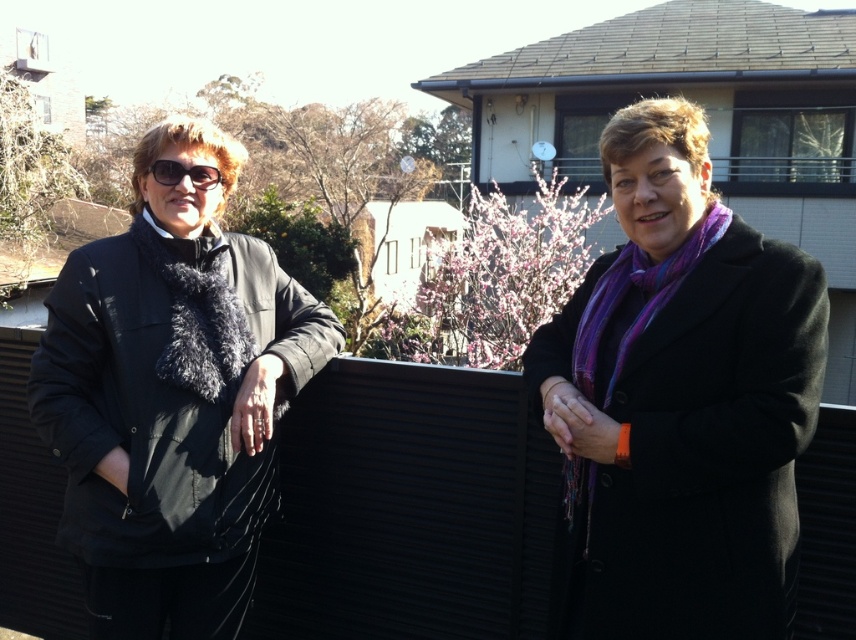
Question: Among these objects, which one is farthest from the camera?

Choices:
 (A) purple wool scarf at center
 (B) black fuzzy scarf at left
 (C) black matte sunglasses at left

Answer: (C)

Question: Does black fuzzy scarf at left appear under black matte sunglasses at left?

Choices:
 (A) no
 (B) yes

Answer: (B)

Question: Does purple wool scarf at center have a larger size compared to black fuzzy scarf at left?

Choices:
 (A) no
 (B) yes

Answer: (A)

Question: Among these objects, which one is farthest from the camera?

Choices:
 (A) black matte sunglasses at left
 (B) purple wool scarf at center

Answer: (A)

Question: Can you confirm if purple wool scarf at center is positioned to the right of black matte sunglasses at left?

Choices:
 (A) no
 (B) yes

Answer: (B)

Question: Among these points, which one is farthest from the camera?

Choices:
 (A) (756, 241)
 (B) (181, 177)
 (C) (186, 332)

Answer: (B)